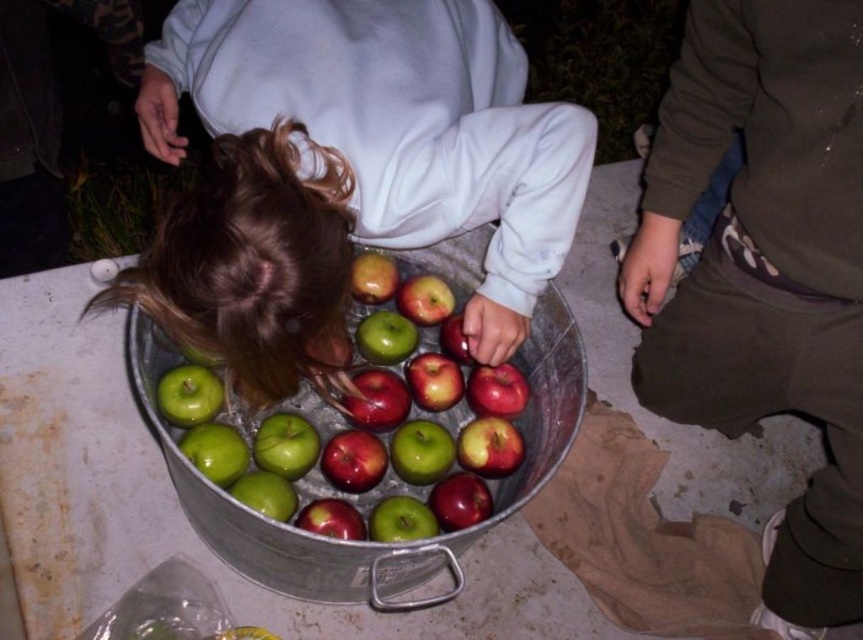
Question: Observing the image, what is the correct spatial positioning of dark green pants at lower right in reference to green shiny apple at center?

Choices:
 (A) above
 (B) below

Answer: (A)

Question: In this image, where is dark green pants at lower right located relative to green shiny apple at center?

Choices:
 (A) below
 (B) above

Answer: (B)

Question: Estimate the real-world distances between objects in this image. Which object is closer to the green shiny apple at center?

Choices:
 (A) dark green pants at lower right
 (B) smooth green apples at center

Answer: (B)

Question: Can you confirm if smooth green apples at center is smaller than green shiny apple at center?

Choices:
 (A) no
 (B) yes

Answer: (A)

Question: Estimate the real-world distances between objects in this image. Which object is farther from the smooth green apples at center?

Choices:
 (A) dark green pants at lower right
 (B) green shiny apple at center

Answer: (A)

Question: Which point is closer to the camera taking this photo?

Choices:
 (A) (381, 324)
 (B) (288, 221)
 (C) (841, 330)

Answer: (B)